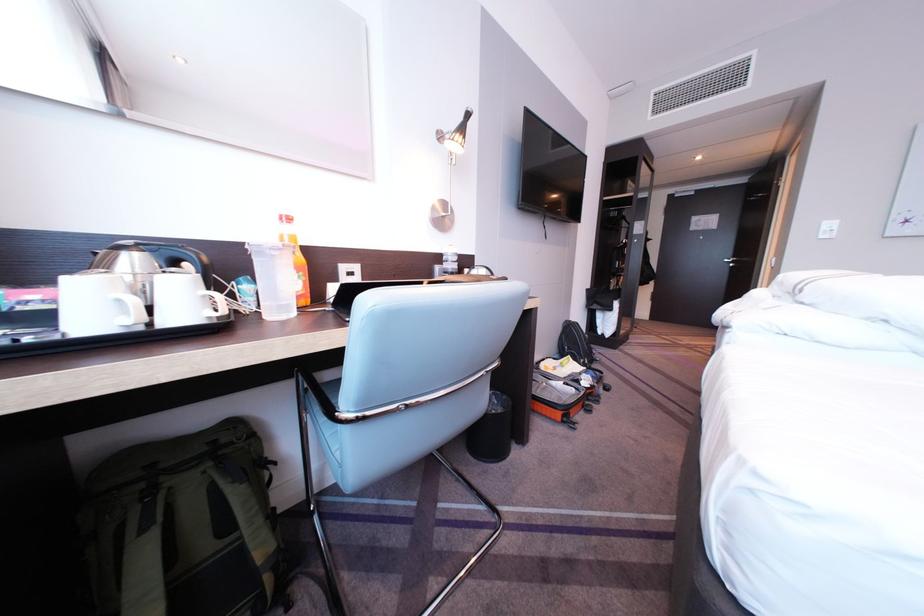
Where is `chair armrest`? The width and height of the screenshot is (924, 616). chair armrest is located at coordinates (314, 392).